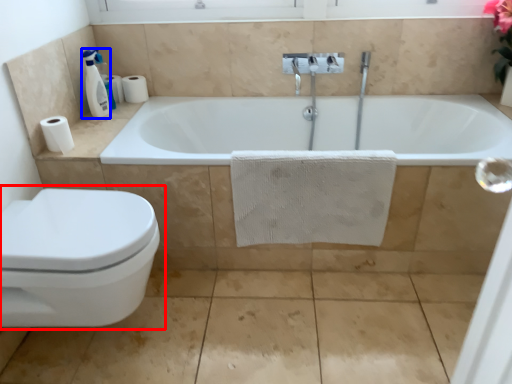
Question: Among these objects, which one is farthest to the camera, toilet (highlighted by a red box) or soap dispenser (highlighted by a blue box)?

Choices:
 (A) toilet
 (B) soap dispenser

Answer: (B)